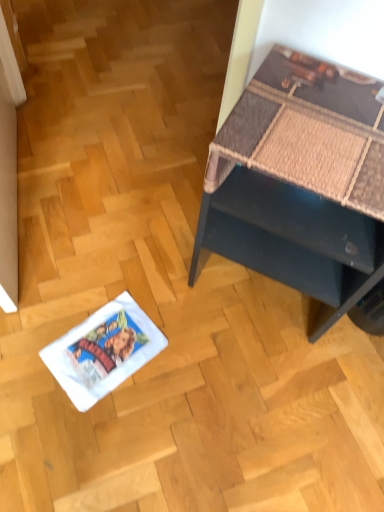
What do you see at coordinates (103, 351) in the screenshot? I see `white paper comic book at lower left` at bounding box center [103, 351].

Identify the location of white paper comic book at lower left. (103, 351).

This screenshot has height=512, width=384. Identify the location of dark blue textured desk at upper right. (300, 182).

What do you see at coordinates (300, 182) in the screenshot? The height and width of the screenshot is (512, 384). I see `dark blue textured desk at upper right` at bounding box center [300, 182].

Find the location of a particular element. This screenshot has width=384, height=512. white paper comic book at lower left is located at coordinates (103, 351).

Is white paper comic book at lower left at the right side of dark blue textured desk at upper right?

No, white paper comic book at lower left is not to the right of dark blue textured desk at upper right.

Relative to dark blue textured desk at upper right, is white paper comic book at lower left in front or behind?

In the image, white paper comic book at lower left appears behind dark blue textured desk at upper right.

Is point (114, 325) closer or farther from the camera than point (275, 225)?

Point (114, 325) is positioned farther from the camera compared to point (275, 225).

From the image's perspective, which one is positioned higher, white paper comic book at lower left or dark blue textured desk at upper right?

dark blue textured desk at upper right.

From a real-world perspective, relative to dark blue textured desk at upper right, is white paper comic book at lower left vertically above or below?

From a real-world perspective, white paper comic book at lower left is physically below dark blue textured desk at upper right.

In terms of width, does white paper comic book at lower left look wider or thinner when compared to dark blue textured desk at upper right?

Clearly, white paper comic book at lower left has less width compared to dark blue textured desk at upper right.

Which of these two, white paper comic book at lower left or dark blue textured desk at upper right, stands taller?

dark blue textured desk at upper right is taller.

Based on the photo, does white paper comic book at lower left have a larger size compared to dark blue textured desk at upper right?

No.

Would you say white paper comic book at lower left is outside dark blue textured desk at upper right?

white paper comic book at lower left is positioned outside dark blue textured desk at upper right.

Would you consider white paper comic book at lower left to be distant from dark blue textured desk at upper right?

That's not correct — white paper comic book at lower left is a little close to dark blue textured desk at upper right.

Is white paper comic book at lower left facing towards dark blue textured desk at upper right?

No, white paper comic book at lower left is not turned towards dark blue textured desk at upper right.

Where is `desk lying on the right of white paper comic book at lower left`? desk lying on the right of white paper comic book at lower left is located at coordinates [x=300, y=182].

Considering the positions of objects dark blue textured desk at upper right and white paper comic book at lower left in the image provided, who is more to the right, dark blue textured desk at upper right or white paper comic book at lower left?

dark blue textured desk at upper right is more to the right.

Which object is more forward, dark blue textured desk at upper right or white paper comic book at lower left?

dark blue textured desk at upper right is closer to the camera.

Is point (254, 132) closer or farther from the camera than point (85, 346)?

Point (254, 132).

From the image's perspective, is dark blue textured desk at upper right located beneath white paper comic book at lower left?

No.

From a real-world perspective, which object stands above the other?

dark blue textured desk at upper right is physically above.

Considering the sizes of dark blue textured desk at upper right and white paper comic book at lower left in the image, is dark blue textured desk at upper right wider or thinner than white paper comic book at lower left?

In the image, dark blue textured desk at upper right appears to be wider than white paper comic book at lower left.

Is dark blue textured desk at upper right taller or shorter than white paper comic book at lower left?

In the image, dark blue textured desk at upper right appears to be taller than white paper comic book at lower left.

Does dark blue textured desk at upper right have a larger size compared to white paper comic book at lower left?

Yes, dark blue textured desk at upper right is bigger than white paper comic book at lower left.

Is dark blue textured desk at upper right inside or outside of white paper comic book at lower left?

dark blue textured desk at upper right is spatially situated outside white paper comic book at lower left.

Would you consider dark blue textured desk at upper right to be distant from white paper comic book at lower left?

They are positioned close to each other.

Is dark blue textured desk at upper right turned away from white paper comic book at lower left?

No.

How different are the orientations of dark blue textured desk at upper right and white paper comic book at lower left in degrees?

22.5 degrees.

Locate an element on the screen. comic book that appears below the dark blue textured desk at upper right (from the image's perspective) is located at coordinates (103, 351).

You are a GUI agent. You are given a task and a screenshot of the screen. Output one action in this format:
    pyautogui.click(x=<x>, y=<y>)
    Task: Click on the comic book below the dark blue textured desk at upper right (from a real-world perspective)
    
    Given the screenshot: What is the action you would take?
    pyautogui.click(x=103, y=351)

Find the location of `desk above the white paper comic book at lower left (from a real-world perspective)`. desk above the white paper comic book at lower left (from a real-world perspective) is located at coordinates (300, 182).